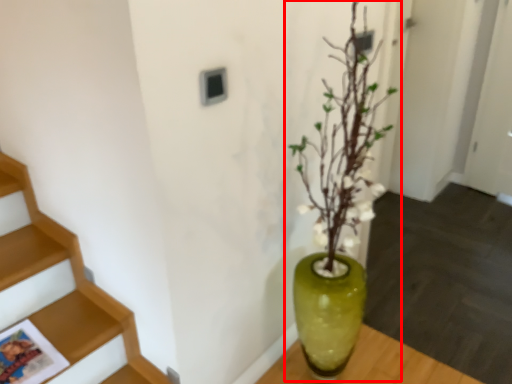
Question: Considering the relative positions of houseplant (annotated by the red box) and vase in the image provided, where is houseplant (annotated by the red box) located with respect to the staircase?

Choices:
 (A) left
 (B) right

Answer: (B)